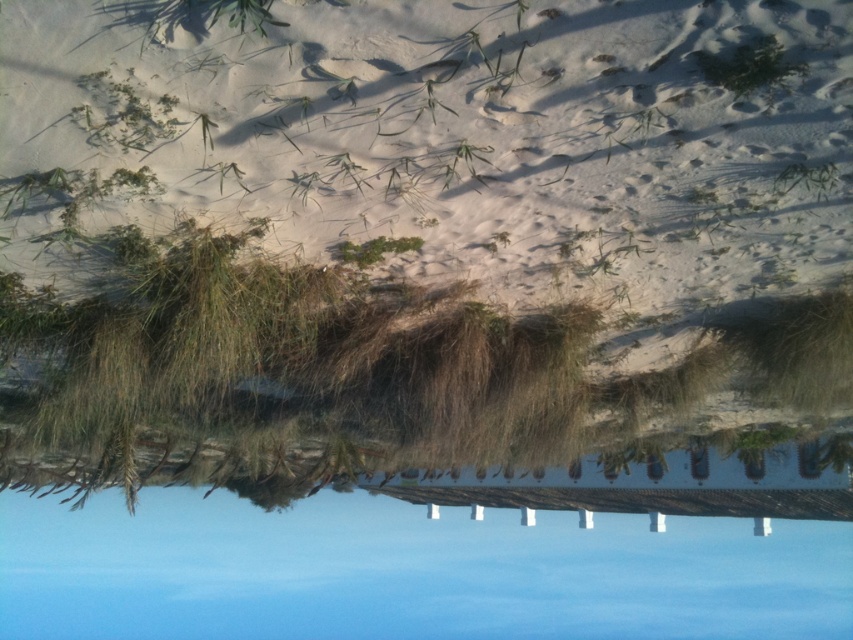
Does white fluffy snow at center have a greater height compared to blue glass lake at center?

No.

Which is behind, point (82, 67) or point (645, 532)?

The point (645, 532) is behind.

Image resolution: width=853 pixels, height=640 pixels. What are the coordinates of `white fluffy snow at center` in the screenshot? It's located at (473, 138).